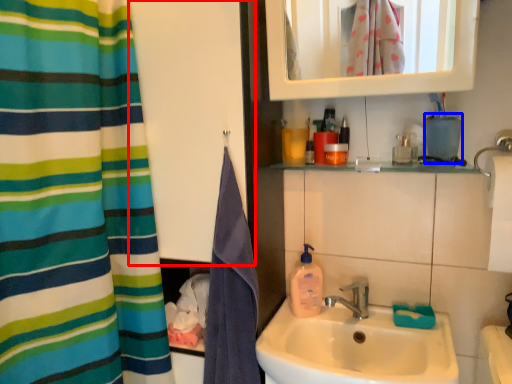
Question: Which object is further to the camera taking this photo, screen door (highlighted by a red box) or teal (highlighted by a blue box)?

Choices:
 (A) screen door
 (B) teal

Answer: (B)